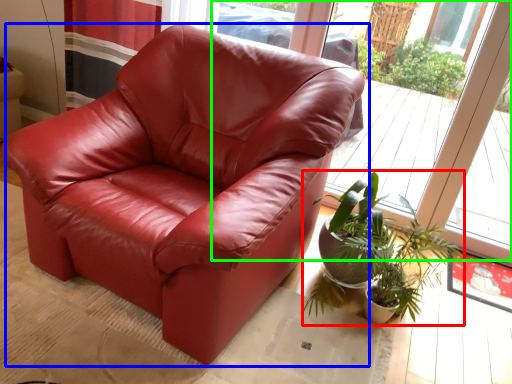
Question: Estimate the real-world distances between objects in this image. Which object is farther from houseplant (highlighted by a red box), chair (highlighted by a blue box) or window (highlighted by a green box)?

Choices:
 (A) chair
 (B) window

Answer: (B)